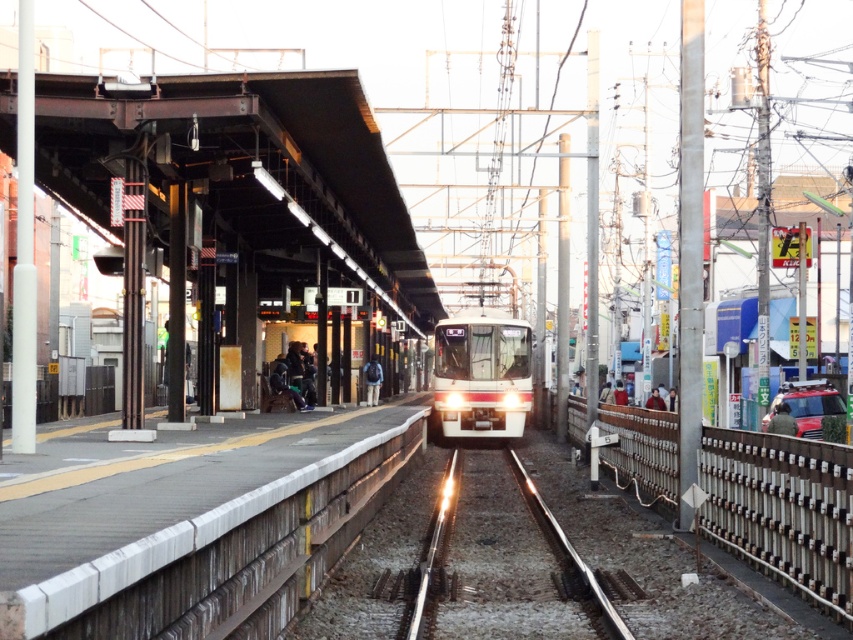
Does concrete platform at center have a smaller size compared to white metal fence at right?

No, concrete platform at center is not smaller than white metal fence at right.

Who is taller, concrete platform at center or white metal fence at right?

white metal fence at right

Image resolution: width=853 pixels, height=640 pixels. Describe the element at coordinates (195, 525) in the screenshot. I see `concrete platform at center` at that location.

Identify the location of concrete platform at center. (195, 525).

At what (x,y) coordinates should I click in order to perform the action: click on metallic silver train track at center. Please return your answer as a coordinate pair (x, y). Looking at the image, I should click on (503, 563).

Between point (436, 566) and point (374, 368), which one is positioned behind?

The point (374, 368) is more distant.

Locate an element on the screen. metallic silver train track at center is located at coordinates (503, 563).

Is metallic silver train track at center thinner than white glossy train at center?

No, metallic silver train track at center is not thinner than white glossy train at center.

Which is above, metallic silver train track at center or white glossy train at center?

white glossy train at center is higher up.

At what (x,y) coordinates should I click in order to perform the action: click on metallic silver train track at center. Please return your answer as a coordinate pair (x, y). Looking at the image, I should click on (503, 563).